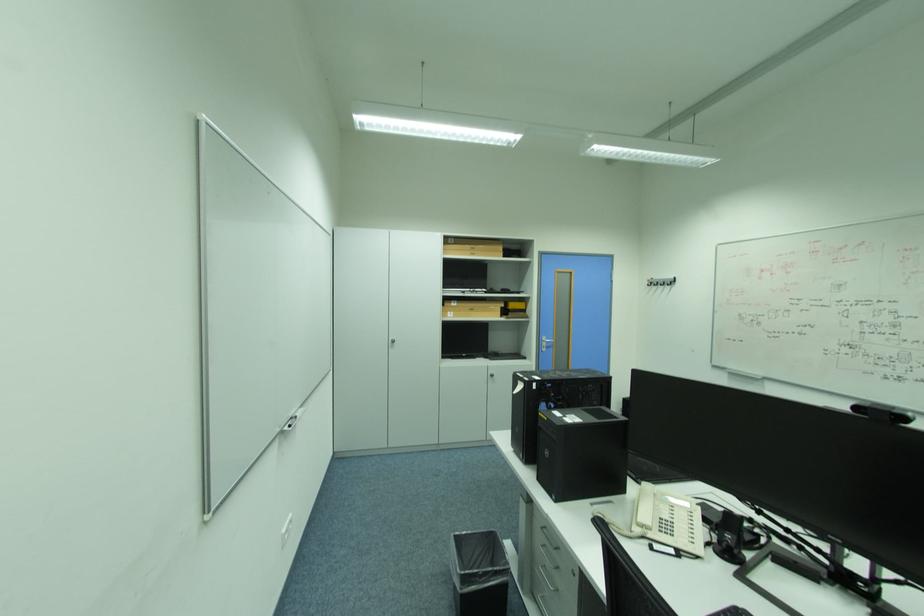
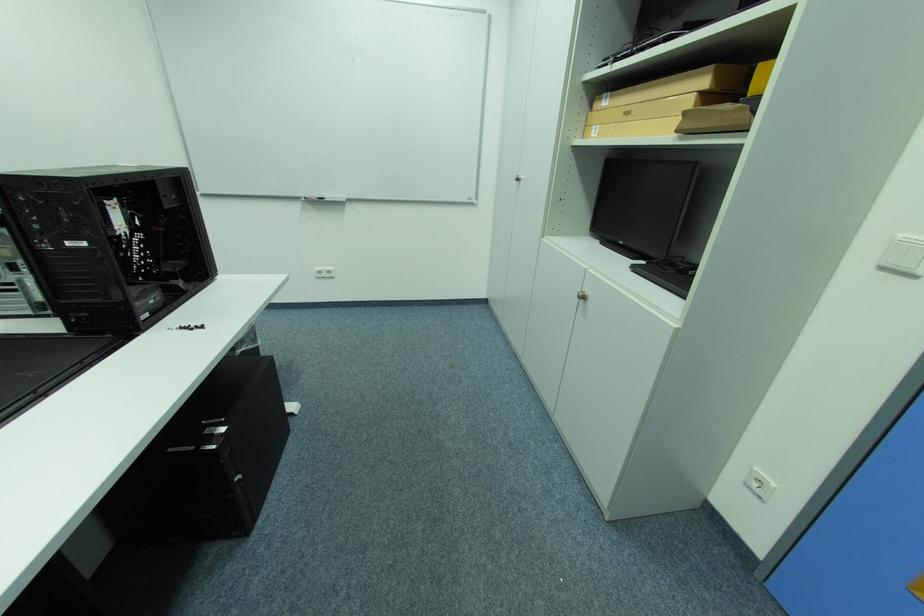
In the second image, find the point that corresponds to [456,313] in the first image.

(602, 128)